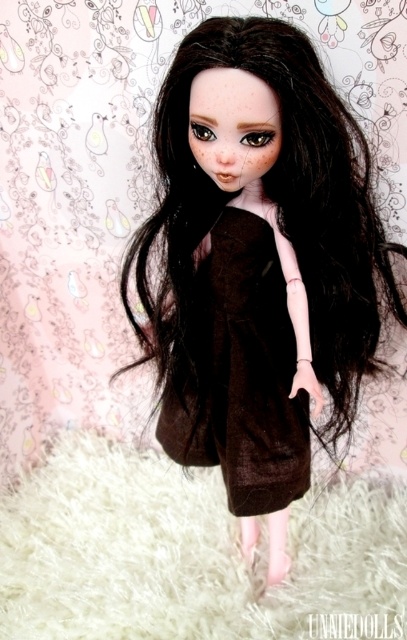
Question: Is black silky hair at center to the right of brown matte dress at center from the viewer's perspective?

Choices:
 (A) no
 (B) yes

Answer: (B)

Question: Can you confirm if black silky hair at center is positioned above brown matte dress at center?

Choices:
 (A) yes
 (B) no

Answer: (A)

Question: Which object is farther from the camera taking this photo?

Choices:
 (A) brown matte dress at center
 (B) black silky hair at center

Answer: (A)

Question: Can you confirm if black silky hair at center is smaller than brown matte dress at center?

Choices:
 (A) yes
 (B) no

Answer: (B)